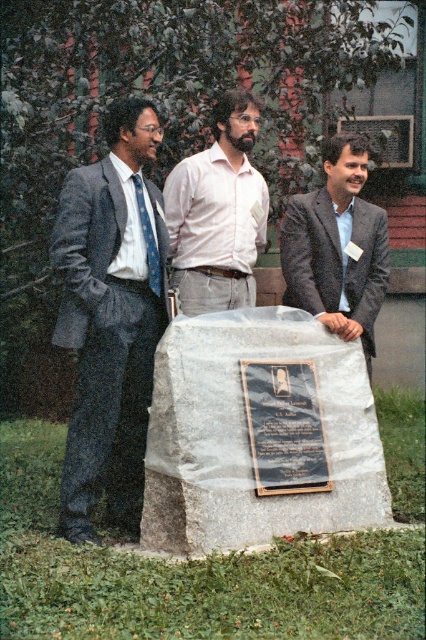
You are standing at the point marked as point (259, 433) in the image. Looking around, you see a gray polished stone at center. Which direction should you walk to reach the gray polished stone at center?

Since you are already at the point where the gray polished stone at center is located, you don not need to move further. You are already at the gray polished stone at center.

You are standing in front of the gray polished stone at center and want to place a bouquet of flowers at its base. If the flowers require a minimum of 3 meters of space to be placed safely, will there be enough space?

The gray polished stone at center is 4.50 meters away from the viewer, so there is sufficient space to place the bouquet of flowers as the required minimum distance is 3 meters.